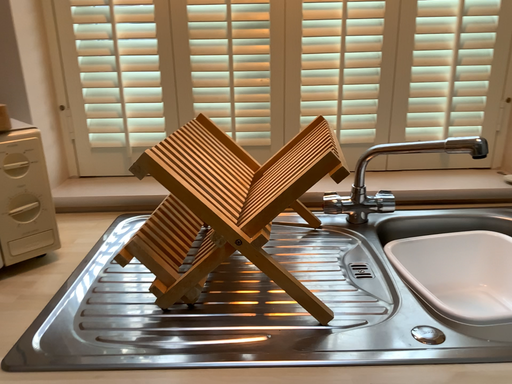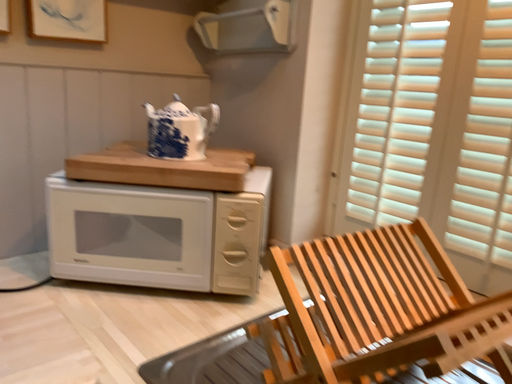
Question: How did the camera likely rotate when shooting the video?

Choices:
 (A) rotated downward
 (B) rotated upward

Answer: (B)